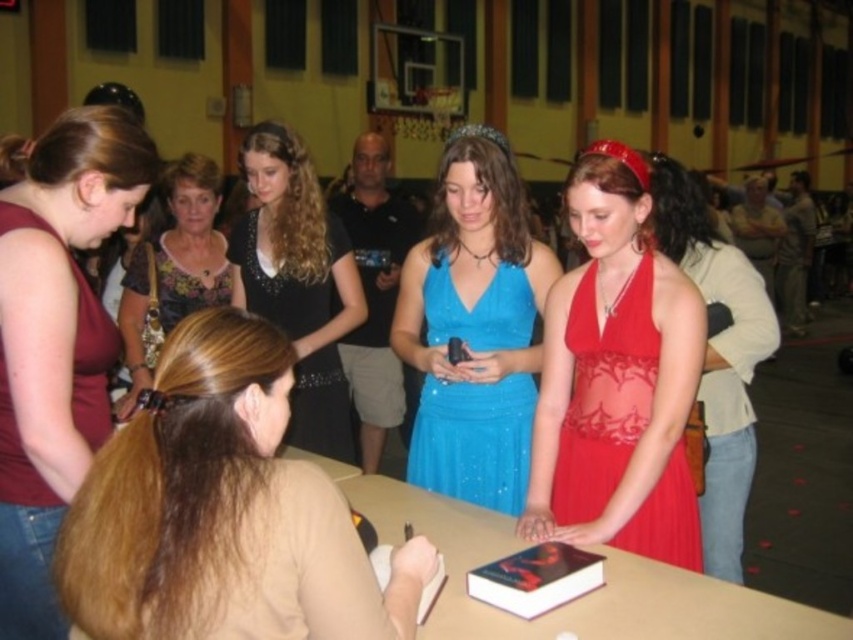
Who is lower down, brown hair at center or matte red dress at center?

brown hair at center

Which of these two, brown hair at center or matte red dress at center, stands taller?

matte red dress at center

The width and height of the screenshot is (853, 640). Describe the element at coordinates (219, 512) in the screenshot. I see `brown hair at center` at that location.

I want to click on brown hair at center, so click(x=219, y=512).

Between matte red dress at center and floral fabric blouse at center, which one has less height?

floral fabric blouse at center is shorter.

Consider the image. Can you confirm if matte red dress at center is thinner than floral fabric blouse at center?

In fact, matte red dress at center might be wider than floral fabric blouse at center.

Is point (695, 202) closer to camera compared to point (137, 384)?

Yes.

You are a GUI agent. You are given a task and a screenshot of the screen. Output one action in this format:
    pyautogui.click(x=<x>, y=<y>)
    Task: Click on the matte red dress at center
    
    Given the screenshot: What is the action you would take?
    pyautogui.click(x=718, y=355)

Between point (213, 483) and point (573, 340), which one is positioned behind?

Positioned behind is point (573, 340).

Which of these two, brown hair at center or satin red dress at center, stands shorter?

brown hair at center

Who is more forward, (x=209, y=364) or (x=631, y=522)?

Point (x=209, y=364) is in front.

The height and width of the screenshot is (640, 853). In order to click on brown hair at center in this screenshot , I will do `click(219, 512)`.